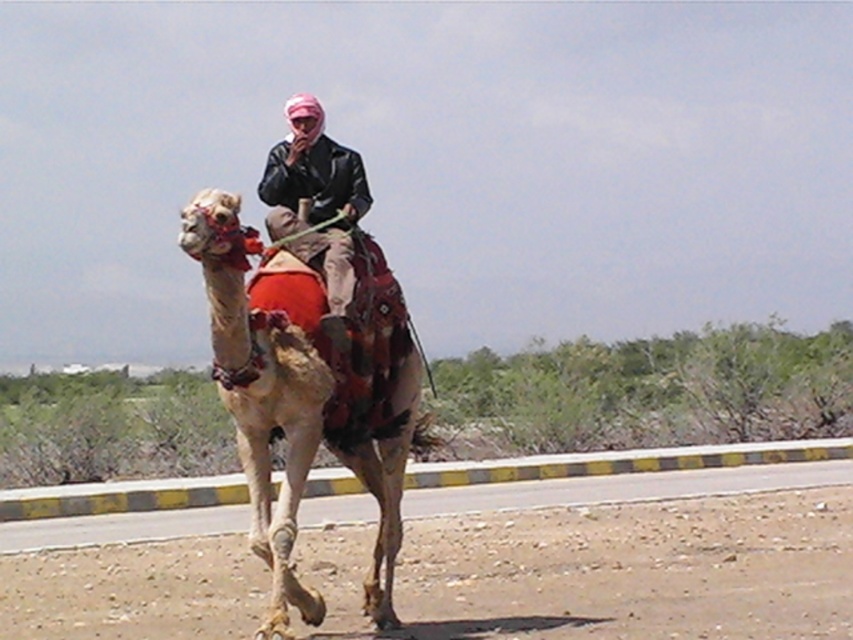
You are standing at the yellow and black striped curb along the road in the image. You see two points marked on the road. Which point is closer to you, point 1 at coordinates (242, 387) or point 2 at coordinates (364, 184)?

Point 1 at coordinates (242, 387) is closer to you than point 2 at coordinates (364, 184).

You are a photographer positioned at the origin point of the image coordinate system. You want to capture a photo of the light brown textured camel at center. What are the coordinates where you should aim your camera?

The coordinates where you should aim your camera are at point (303, 394).

You are a traveler who needs to place a 3 meter long tent between the brown textured sand at lower center and the leather jacket at center. Is there enough space between them to set up the tent?

The distance between the brown textured sand at lower center and the leather jacket at center is 2.59 meters. Since the tent is 3 meters long, there isn not enough space to set it up between them.